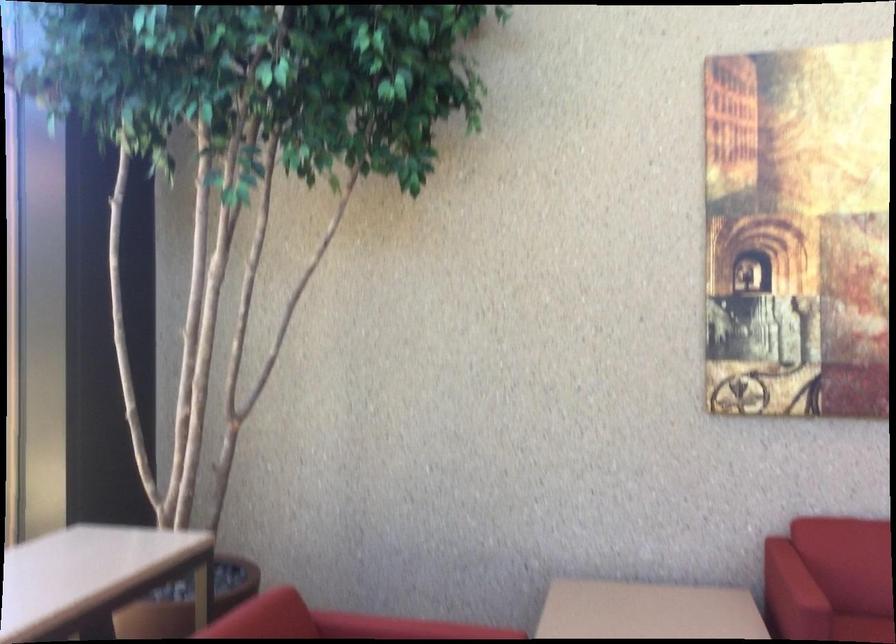
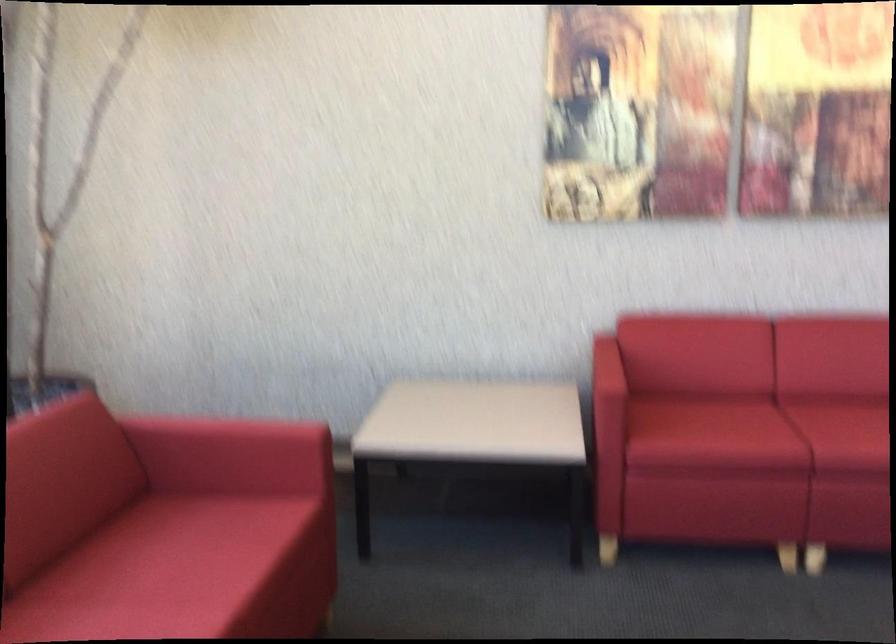
Question: The images are taken continuously from a first-person perspective. In which direction is your viewpoint rotating?

Choices:
 (A) Left
 (B) Right
 (C) Up
 (D) Down

Answer: (D)